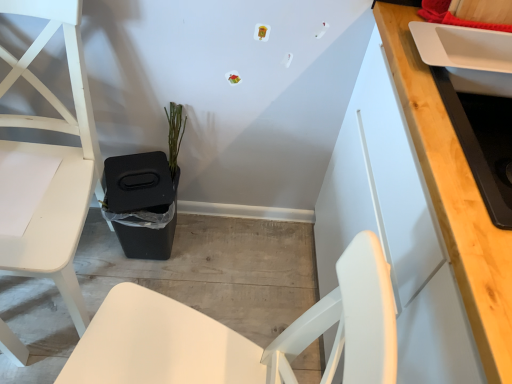
Question: Is white matte chair at left to the left of green matte plant at center from the viewer's perspective?

Choices:
 (A) yes
 (B) no

Answer: (A)

Question: Does white matte chair at left touch green matte plant at center?

Choices:
 (A) yes
 (B) no

Answer: (B)

Question: From a real-world perspective, is white matte chair at left positioned over green matte plant at center based on gravity?

Choices:
 (A) no
 (B) yes

Answer: (B)

Question: Is white matte chair at left turned away from green matte plant at center?

Choices:
 (A) yes
 (B) no

Answer: (B)

Question: Considering the relative sizes of white matte chair at left and green matte plant at center in the image provided, is white matte chair at left bigger than green matte plant at center?

Choices:
 (A) no
 (B) yes

Answer: (B)

Question: In terms of height, does white matte chair at left look taller or shorter compared to green matte plant at center?

Choices:
 (A) tall
 (B) short

Answer: (A)

Question: Would you say white matte chair at left is inside or outside green matte plant at center?

Choices:
 (A) outside
 (B) inside

Answer: (A)

Question: In terms of size, does white matte chair at left appear bigger or smaller than green matte plant at center?

Choices:
 (A) big
 (B) small

Answer: (A)

Question: In terms of width, does white matte chair at left look wider or thinner when compared to green matte plant at center?

Choices:
 (A) thin
 (B) wide

Answer: (B)

Question: Considering the positions of green matte plant at center and white glossy sink at upper right in the image, is green matte plant at center wider or thinner than white glossy sink at upper right?

Choices:
 (A) wide
 (B) thin

Answer: (B)

Question: From a real-world perspective, is green matte plant at center positioned above or below white glossy sink at upper right?

Choices:
 (A) below
 (B) above

Answer: (A)

Question: In terms of height, does green matte plant at center look taller or shorter compared to white glossy sink at upper right?

Choices:
 (A) short
 (B) tall

Answer: (B)

Question: In terms of size, does green matte plant at center appear bigger or smaller than white glossy sink at upper right?

Choices:
 (A) big
 (B) small

Answer: (B)

Question: Based on their positions, is white matte chair at left located to the left or right of white glossy sink at upper right?

Choices:
 (A) left
 (B) right

Answer: (A)

Question: Is point (66, 220) closer or farther from the camera than point (480, 115)?

Choices:
 (A) closer
 (B) farther

Answer: (B)